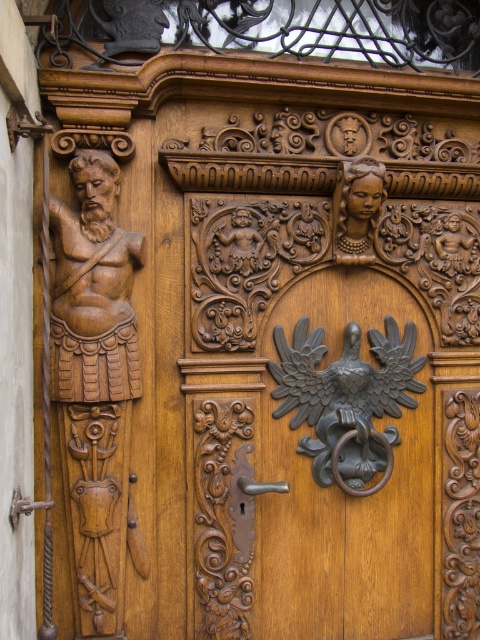
You are standing in front of a wooden door with carvings. There is a point marked at coordinates (94, 288). What object is located at this point?

The point at coordinates (94, 288) marks the wooden carving at left.

You are a visitor approaching the wooden door and want to open it. You see the polished bronze eagle at center and the polished brass door handle at lower left. Which object should you grab to open the door?

The polished brass door handle at lower left is the correct object to grab to open the door, as it is a functional handle, while the polished bronze eagle at center is likely a decorative element.